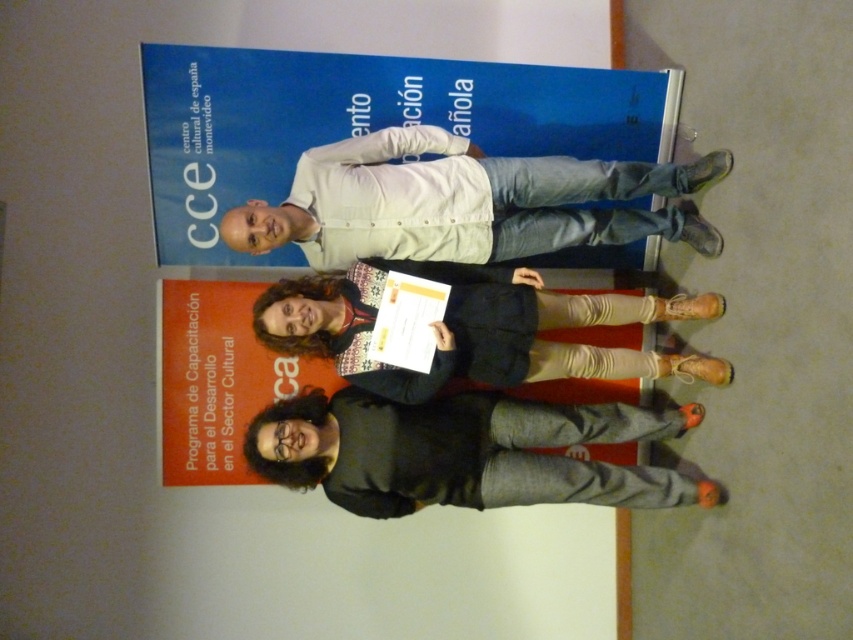
Question: Observing the image, what is the correct spatial positioning of gray cotton pants at lower center in reference to knitted sweater at center?

Choices:
 (A) above
 (B) below

Answer: (B)

Question: Considering the real-world distances, which object is closest to the white matte shirt at upper center?

Choices:
 (A) knitted sweater at center
 (B) gray cotton pants at lower center

Answer: (A)

Question: Is gray cotton pants at lower center smaller than knitted sweater at center?

Choices:
 (A) no
 (B) yes

Answer: (B)

Question: Can you confirm if white matte shirt at upper center is wider than gray cotton pants at lower center?

Choices:
 (A) yes
 (B) no

Answer: (A)

Question: Which object is closer to the camera taking this photo?

Choices:
 (A) gray cotton pants at lower center
 (B) knitted sweater at center
 (C) white matte shirt at upper center

Answer: (C)

Question: Which object is closer to the camera taking this photo?

Choices:
 (A) gray cotton pants at lower center
 (B) knitted sweater at center

Answer: (B)